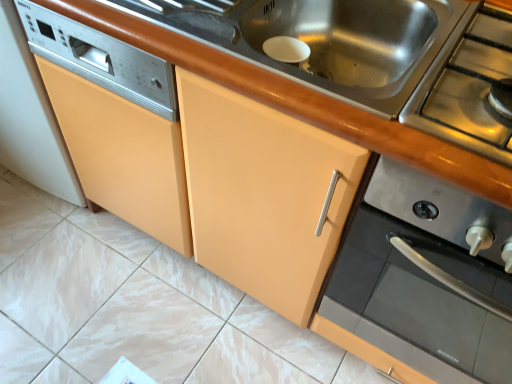
Question: Is stainless steel gas stove at right turned away from stainless steel stove at upper right?

Choices:
 (A) yes
 (B) no

Answer: (B)

Question: From the image's perspective, is stainless steel gas stove at right beneath stainless steel stove at upper right?

Choices:
 (A) yes
 (B) no

Answer: (B)

Question: Does stainless steel gas stove at right touch stainless steel stove at upper right?

Choices:
 (A) no
 (B) yes

Answer: (A)

Question: From a real-world perspective, is stainless steel gas stove at right positioned under stainless steel stove at upper right based on gravity?

Choices:
 (A) yes
 (B) no

Answer: (B)

Question: From a real-world perspective, is stainless steel gas stove at right over stainless steel stove at upper right?

Choices:
 (A) yes
 (B) no

Answer: (A)

Question: Is stainless steel gas stove at right positioned behind stainless steel stove at upper right?

Choices:
 (A) yes
 (B) no

Answer: (A)

Question: Does stainless steel sink at center appear on the left side of stainless steel gas stove at right?

Choices:
 (A) no
 (B) yes

Answer: (B)

Question: From the image's perspective, is stainless steel sink at center located above stainless steel gas stove at right?

Choices:
 (A) yes
 (B) no

Answer: (A)

Question: Would you say stainless steel sink at center is a long distance from stainless steel gas stove at right?

Choices:
 (A) yes
 (B) no

Answer: (B)

Question: Can you confirm if stainless steel sink at center is smaller than stainless steel gas stove at right?

Choices:
 (A) yes
 (B) no

Answer: (B)

Question: Does stainless steel sink at center appear on the right side of stainless steel gas stove at right?

Choices:
 (A) no
 (B) yes

Answer: (A)

Question: Does stainless steel sink at center have a lesser width compared to stainless steel gas stove at right?

Choices:
 (A) yes
 (B) no

Answer: (B)

Question: Is the surface of stainless steel gas stove at right in direct contact with stainless steel sink at center?

Choices:
 (A) no
 (B) yes

Answer: (A)